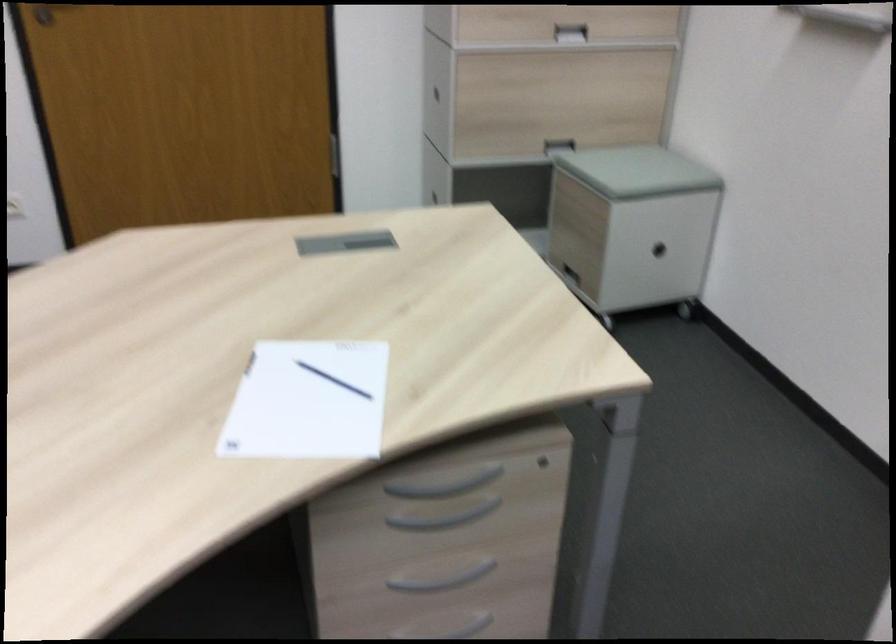
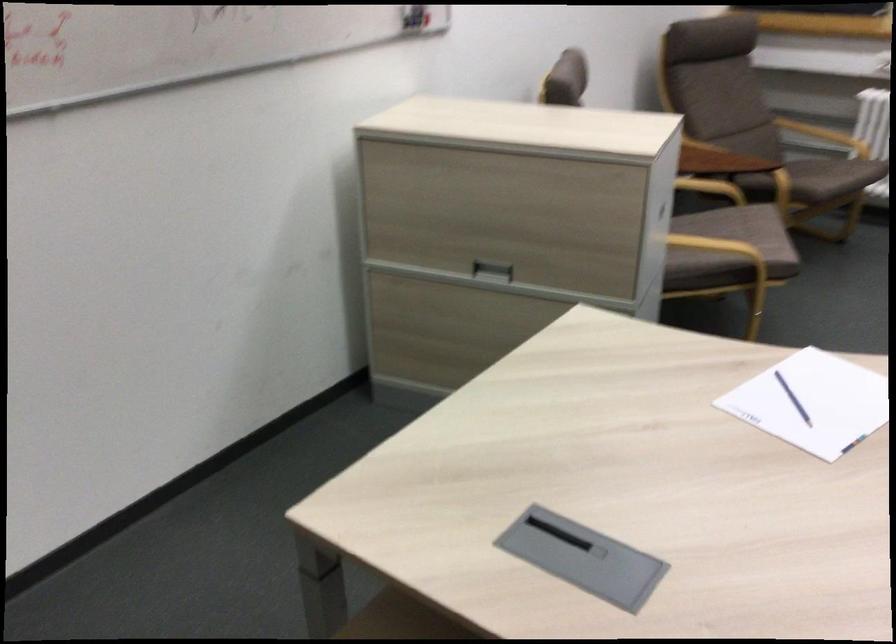
In the second image, find the point that corresponds to point 336,400 in the first image.

(793, 399)